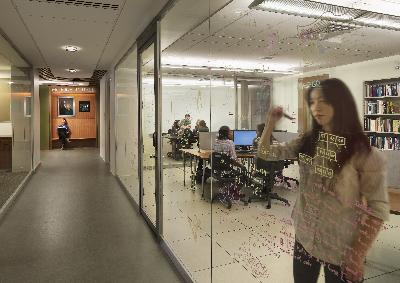
At what (x,y) coordinates should I click in order to perform the action: click on hallway. Please return your answer as a coordinate pair (x, y). Looking at the image, I should click on (82, 201).